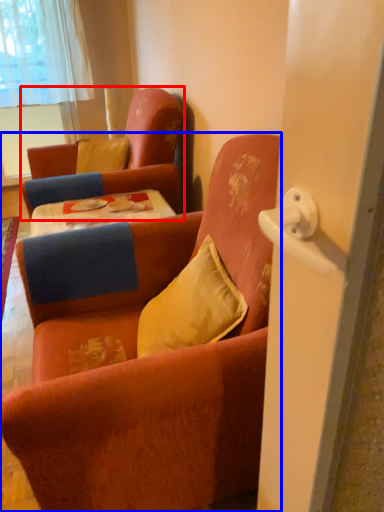
Question: Which object appears farthest to the camera in this image, chair (highlighted by a red box) or chair (highlighted by a blue box)?

Choices:
 (A) chair
 (B) chair

Answer: (A)